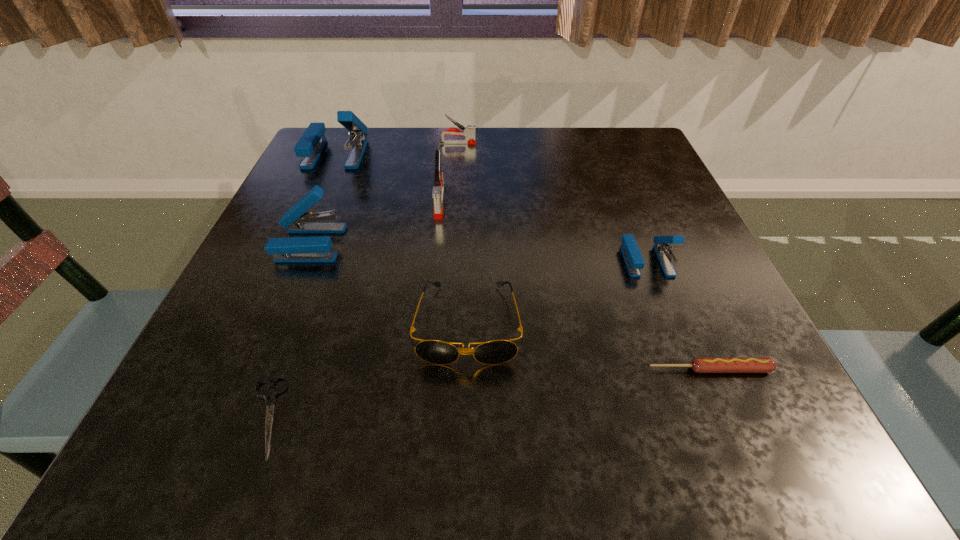
Where is `vacant region that satisfies the following two spatial constraints: 1. on the lenses of the brown sausage; 2. on the right side of the sunglasses`? The width and height of the screenshot is (960, 540). vacant region that satisfies the following two spatial constraints: 1. on the lenses of the brown sausage; 2. on the right side of the sunglasses is located at coordinates (467, 369).

This screenshot has width=960, height=540. I want to click on free space that satisfies the following two spatial constraints: 1. on the handle side of the smaller gray stapler; 2. on the right side of the rightmost blue stapler, so click(449, 260).

This screenshot has width=960, height=540. Identify the location of free location that satisfies the following two spatial constraints: 1. on the handle side of the farther gray stapler; 2. on the left side of the smallest blue stapler. (449, 260).

The width and height of the screenshot is (960, 540). I want to click on vacant area that satisfies the following two spatial constraints: 1. on the handle side of the smaller gray stapler; 2. on the right side of the seventh tallest object, so click(x=442, y=369).

You are a GUI agent. You are given a task and a screenshot of the screen. Output one action in this format:
    pyautogui.click(x=<x>, y=<y>)
    Task: Click on the vacant region that satisfies the following two spatial constraints: 1. on the handle side of the smallest blue stapler; 2. on the left side of the bigger gray stapler
    This screenshot has height=540, width=960.
    Given the screenshot: What is the action you would take?
    pyautogui.click(x=434, y=260)